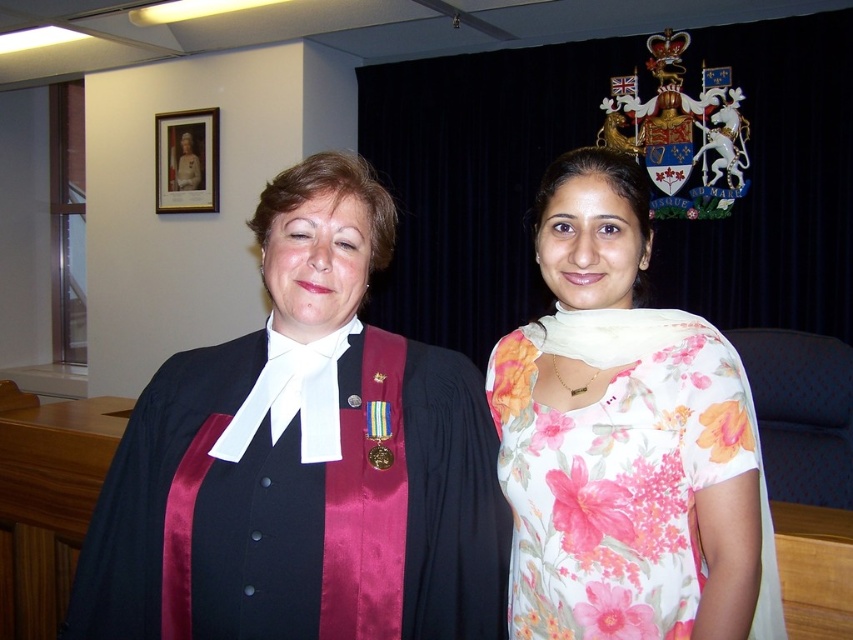
You are an interior designer analyzing the image. The floral cotton dress at center is placed in a specific location. Based on its coordinates, can you determine if it is positioned closer to the left or the right side of the room?

The floral cotton dress at center is located at point 0.689 on the x and y axis, which places it closer to the right side of the room.

You are taking a photo of two people in a formal setting. You notice two points in the image at coordinates point (260, 609) and point (589, 237). Which point is closer to the camera?

Point (260, 609) is closer to the camera than point (589, 237).

You are an assistant at a formal event and need to determine which robe is more suitable for a ceremonial role based on the description provided. Which robe, the satin black robe at center or the matte black robe at center, is taller and thus more appropriate for the ceremonial role?

The satin black robe at center has a greater height compared to the matte black robe at center, making it more appropriate for the ceremonial role.